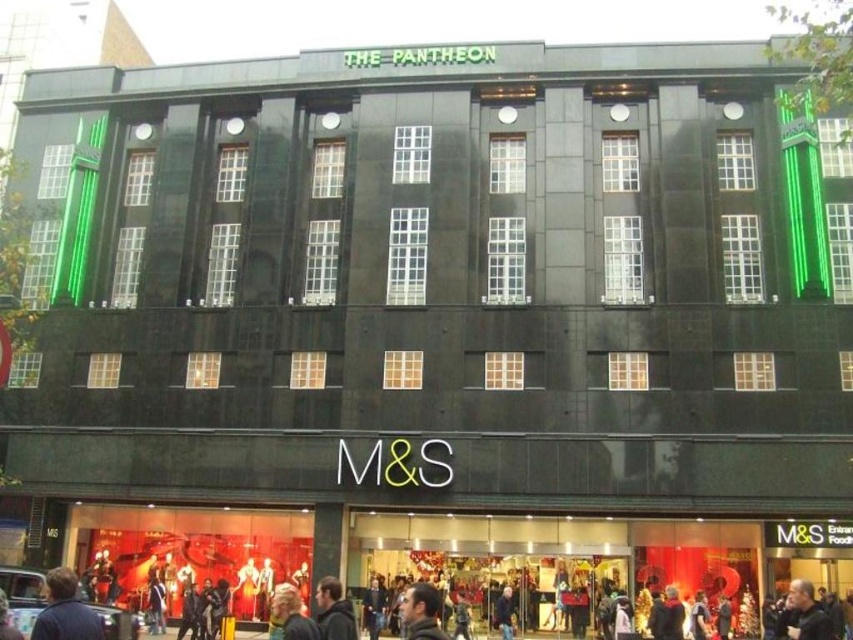
In the scene shown: Can you confirm if dark blue jacket at lower left is smaller than dark brown jacket at center?

Incorrect, dark blue jacket at lower left is not smaller in size than dark brown jacket at center.

Is dark blue jacket at lower left positioned in front of dark brown jacket at center?

Yes.

Which is in front, point (64, 604) or point (328, 605)?

Point (64, 604)

The height and width of the screenshot is (640, 853). Find the location of `dark blue jacket at lower left`. dark blue jacket at lower left is located at coordinates (65, 611).

Who is lower down, dark blue jacket at lower left or dark brown hair at lower center?

Positioned lower is dark brown hair at lower center.

Is dark blue jacket at lower left wider than dark brown hair at lower center?

Yes.

This screenshot has width=853, height=640. What do you see at coordinates (65, 611) in the screenshot?
I see `dark blue jacket at lower left` at bounding box center [65, 611].

This screenshot has height=640, width=853. I want to click on dark blue jacket at lower left, so click(x=65, y=611).

In the scene shown: Who is positioned more to the right, dark brown hair at lower center or dark brown jacket at center?

Positioned to the right is dark brown hair at lower center.

This screenshot has height=640, width=853. I want to click on dark brown hair at lower center, so click(421, 612).

You are a GUI agent. You are given a task and a screenshot of the screen. Output one action in this format:
    pyautogui.click(x=<x>, y=<y>)
    Task: Click on the dark brown hair at lower center
    The image size is (853, 640).
    Given the screenshot: What is the action you would take?
    pyautogui.click(x=421, y=612)